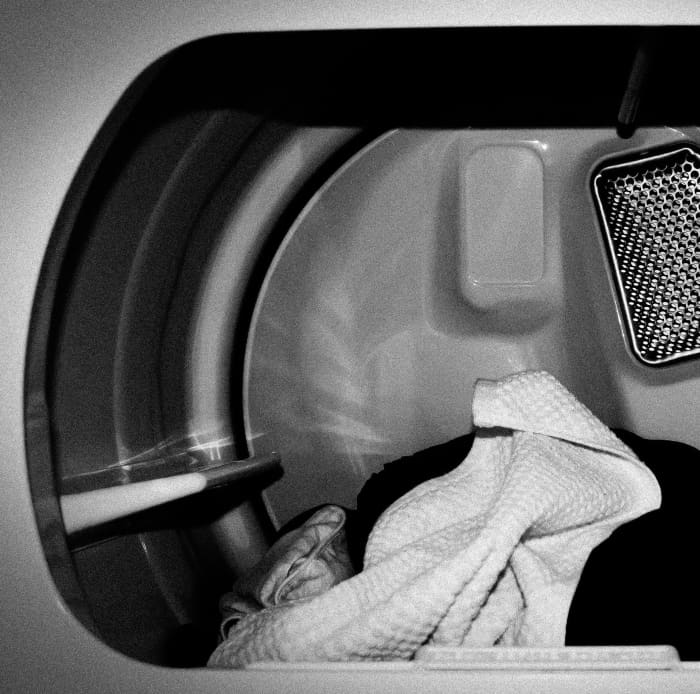
This screenshot has height=694, width=700. Identify the location of black item in dryer. (666, 563).